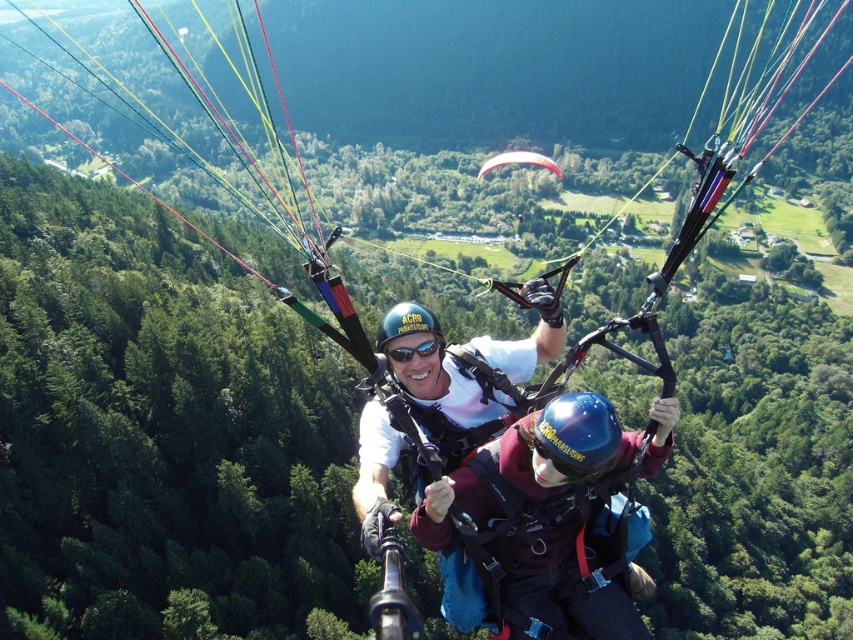
Between point (604, 435) and point (541, 156), which one is positioned in front?

Point (604, 435) is more forward.

Can you confirm if maroon fleece jacket at center is taller than red nylon parachute at center?

No, maroon fleece jacket at center is not taller than red nylon parachute at center.

Does point (521, 476) come farther from viewer compared to point (544, 161)?

No, (521, 476) is closer to viewer.

Identify the location of maroon fleece jacket at center. The image size is (853, 640). (544, 518).

Does red nylon parachute at center have a larger size compared to black matte goggles at center?

Correct, red nylon parachute at center is larger in size than black matte goggles at center.

Who is more distant from viewer, (538,154) or (393,358)?

Positioned behind is point (538,154).

Who is more distant from viewer, (555, 163) or (428, 352)?

The point (555, 163) is behind.

The image size is (853, 640). I want to click on red nylon parachute at center, so (x=519, y=161).

Does point (605, 572) come in front of point (410, 348)?

Yes, it is.

Does point (555, 604) come in front of point (431, 348)?

That is True.

Image resolution: width=853 pixels, height=640 pixels. I want to click on maroon fleece jacket at center, so click(544, 518).